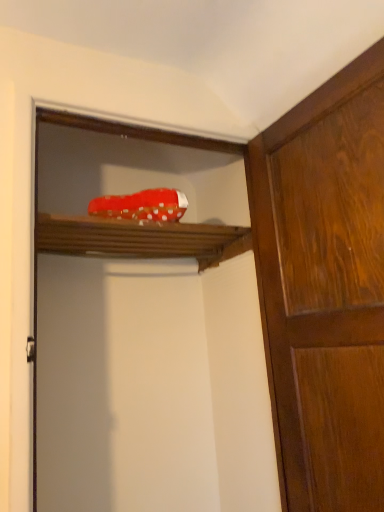
Question: Does wooden shelf at upper center turn towards red fabric shoe at upper center?

Choices:
 (A) no
 (B) yes

Answer: (B)

Question: Is wooden shelf at upper center further to the viewer compared to red fabric shoe at upper center?

Choices:
 (A) no
 (B) yes

Answer: (B)

Question: From the image's perspective, is wooden shelf at upper center located beneath red fabric shoe at upper center?

Choices:
 (A) yes
 (B) no

Answer: (B)

Question: Considering the relative sizes of wooden shelf at upper center and red fabric shoe at upper center in the image provided, is wooden shelf at upper center smaller than red fabric shoe at upper center?

Choices:
 (A) no
 (B) yes

Answer: (B)

Question: From the image's perspective, does wooden shelf at upper center appear higher than red fabric shoe at upper center?

Choices:
 (A) yes
 (B) no

Answer: (A)

Question: From their relative heights in the image, would you say wooden shelf at upper center is taller or shorter than wooden cabinet at right?

Choices:
 (A) short
 (B) tall

Answer: (A)

Question: Is wooden shelf at upper center in front of or behind wooden cabinet at right in the image?

Choices:
 (A) front
 (B) behind

Answer: (B)

Question: Would you say wooden shelf at upper center is to the left or to the right of wooden cabinet at right in the picture?

Choices:
 (A) right
 (B) left

Answer: (B)

Question: Would you say wooden shelf at upper center is inside or outside wooden cabinet at right?

Choices:
 (A) outside
 (B) inside

Answer: (A)

Question: Would you say wooden cabinet at right is inside or outside wooden shelf at upper center?

Choices:
 (A) outside
 (B) inside

Answer: (A)

Question: Considering the positions of wooden cabinet at right and wooden shelf at upper center in the image, is wooden cabinet at right wider or thinner than wooden shelf at upper center?

Choices:
 (A) wide
 (B) thin

Answer: (B)

Question: Based on their positions, is wooden cabinet at right located to the left or right of wooden shelf at upper center?

Choices:
 (A) right
 (B) left

Answer: (A)

Question: Is wooden cabinet at right in front of or behind wooden shelf at upper center in the image?

Choices:
 (A) front
 (B) behind

Answer: (A)

Question: From the image's perspective, is wooden cabinet at right located above or below red fabric shoe at upper center?

Choices:
 (A) below
 (B) above

Answer: (B)

Question: In terms of height, does wooden cabinet at right look taller or shorter compared to red fabric shoe at upper center?

Choices:
 (A) tall
 (B) short

Answer: (B)